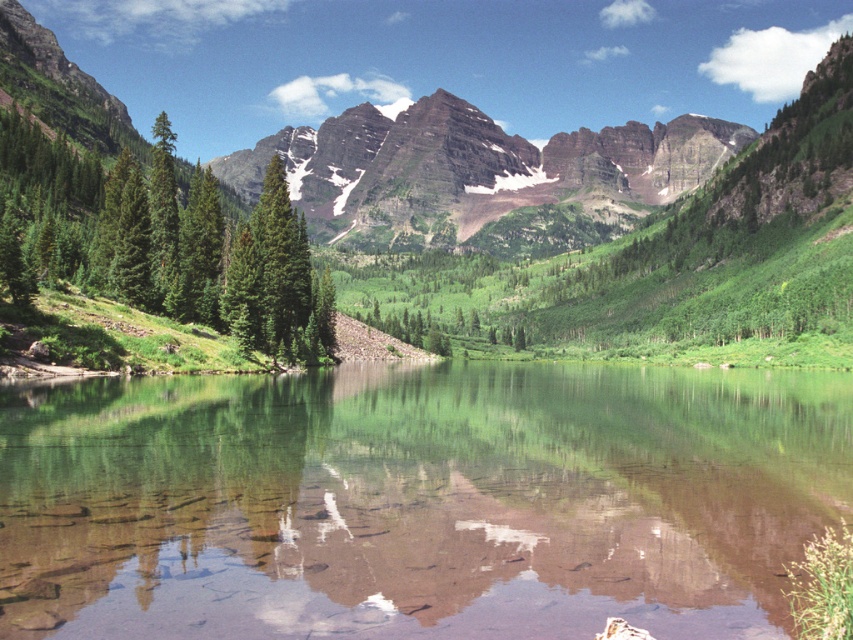
Does rugged granite mountain at center have a lesser height compared to green matte tree at center?

No.

Is rugged granite mountain at center positioned at the back of green matte tree at center?

Yes, rugged granite mountain at center is behind green matte tree at center.

Find the location of `rugged granite mountain at center`. rugged granite mountain at center is located at coordinates (473, 170).

Locate an element on the screen. rugged granite mountain at center is located at coordinates (473, 170).

Between clear water at center and rugged granite mountain at center, which one has more height?

rugged granite mountain at center is taller.

Between clear water at center and rugged granite mountain at center, which one is positioned higher?

Positioned higher is rugged granite mountain at center.

Identify the location of clear water at center. (416, 500).

Can you confirm if clear water at center is positioned to the right of green matte tree at left?

Indeed, clear water at center is positioned on the right side of green matte tree at left.

In the scene shown: Who is more distant from viewer, (671, 499) or (219, 243)?

The point (219, 243) is behind.

Where is `clear water at center`? Image resolution: width=853 pixels, height=640 pixels. clear water at center is located at coordinates (416, 500).